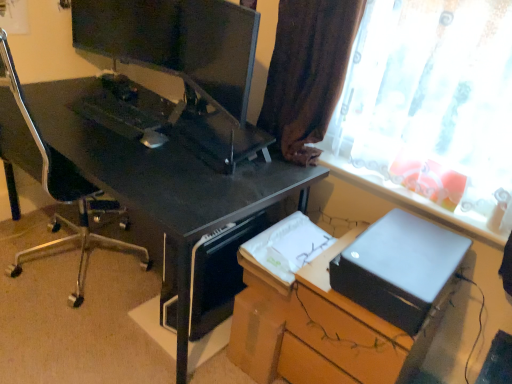
Question: From a real-world perspective, is black plastic computer tower at lower center positioned under satin black printer at lower right based on gravity?

Choices:
 (A) no
 (B) yes

Answer: (A)

Question: Considering the relative positions of black plastic computer tower at lower center and satin black printer at lower right in the image provided, is black plastic computer tower at lower center behind satin black printer at lower right?

Choices:
 (A) no
 (B) yes

Answer: (B)

Question: Is satin black printer at lower right completely or partially inside black plastic computer tower at lower center?

Choices:
 (A) no
 (B) yes

Answer: (A)

Question: Can you see black plastic computer tower at lower center touching satin black printer at lower right?

Choices:
 (A) yes
 (B) no

Answer: (B)

Question: Is black plastic computer tower at lower center oriented towards satin black printer at lower right?

Choices:
 (A) yes
 (B) no

Answer: (B)

Question: Is matte black printer at right to the left or to the right of translucent fabric curtain at upper right in the image?

Choices:
 (A) left
 (B) right

Answer: (A)

Question: In terms of height, does matte black printer at right look taller or shorter compared to translucent fabric curtain at upper right?

Choices:
 (A) tall
 (B) short

Answer: (B)

Question: From the image's perspective, relative to translucent fabric curtain at upper right, is matte black printer at right above or below?

Choices:
 (A) above
 (B) below

Answer: (B)

Question: Considering the positions of point (387, 240) and point (362, 54), is point (387, 240) closer or farther from the camera than point (362, 54)?

Choices:
 (A) farther
 (B) closer

Answer: (B)

Question: Considering the positions of matte black printer at right and black plastic computer tower at lower center in the image, is matte black printer at right wider or thinner than black plastic computer tower at lower center?

Choices:
 (A) wide
 (B) thin

Answer: (B)

Question: Is matte black printer at right bigger or smaller than black plastic computer tower at lower center?

Choices:
 (A) small
 (B) big

Answer: (A)

Question: Is point (415, 326) closer or farther from the camera than point (172, 276)?

Choices:
 (A) closer
 (B) farther

Answer: (A)

Question: From a real-world perspective, is matte black printer at right physically located above or below black plastic computer tower at lower center?

Choices:
 (A) above
 (B) below

Answer: (A)

Question: Considering the positions of black plastic computer tower at lower center and black glossy desk at center in the image, is black plastic computer tower at lower center taller or shorter than black glossy desk at center?

Choices:
 (A) tall
 (B) short

Answer: (B)

Question: Is point [x=212, y=248] closer or farther from the camera than point [x=176, y=220]?

Choices:
 (A) closer
 (B) farther

Answer: (B)